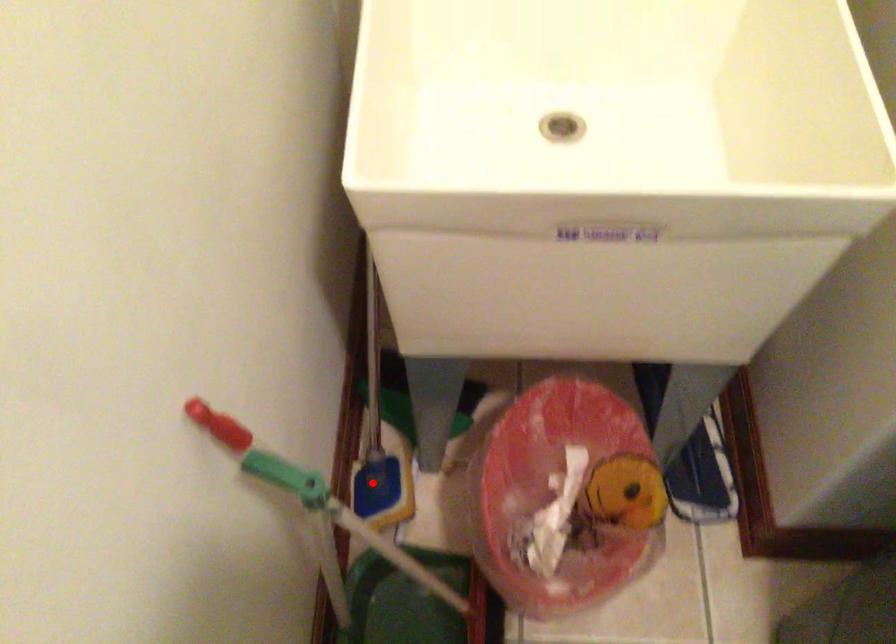
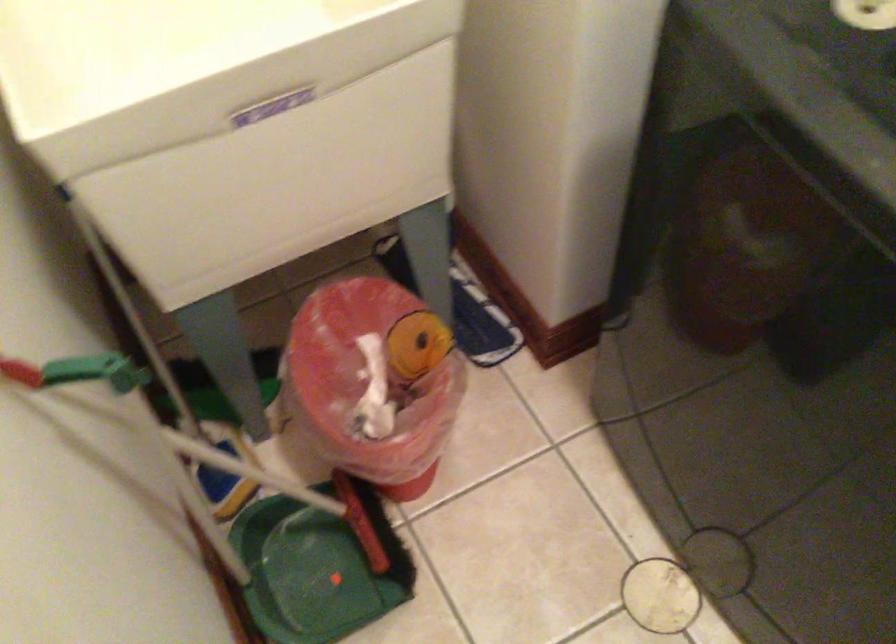
Question: I am providing you with two images of the same scene from different viewpoints. A red point is marked on the first image. Is the red point's position out of view in image 2?

Choices:
 (A) Yes
 (B) No

Answer: (A)